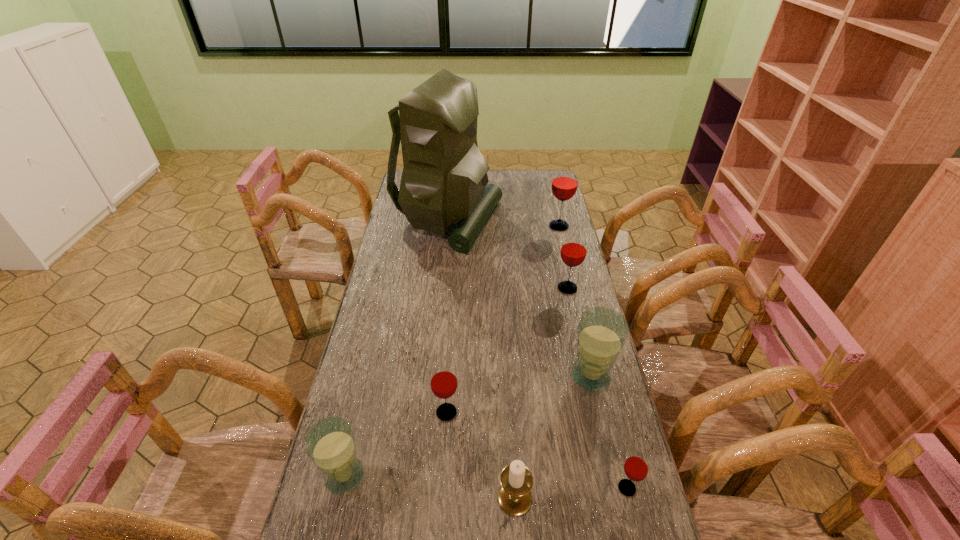
Point out which red glass is positioned as the second nearest to the shortest object. Please provide its 2D coordinates. Your answer should be formatted as a tuple, i.e. [(x, y)], where the tuple contains the x and y coordinates of a point satisfying the conditions above.

[(573, 252)]

Identify the location of blue glass that is the nearest to the backpack. This screenshot has width=960, height=540. (602, 332).

At what (x,y) coordinates should I click in order to perform the action: click on free spot that satisfies the following two spatial constraints: 1. on the front of the backpack with visible pockets; 2. on the left side of the second biggest red glass. Please return your answer as a coordinate pair (x, y). Looking at the image, I should click on (441, 288).

In order to click on free point that satisfies the following two spatial constraints: 1. on the front of the tallest object with visible pockets; 2. on the right side of the fourth nearest object in this screenshot , I will do `click(428, 413)`.